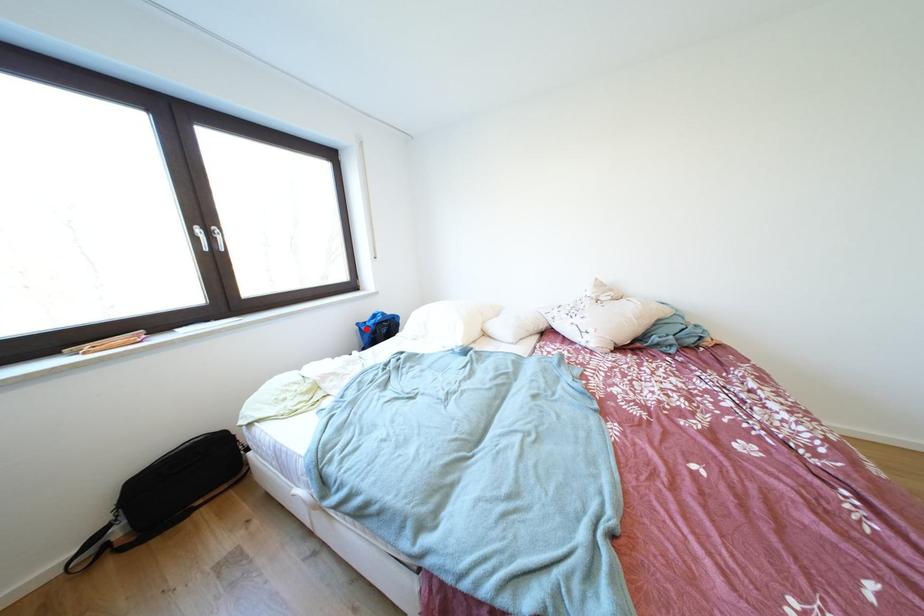
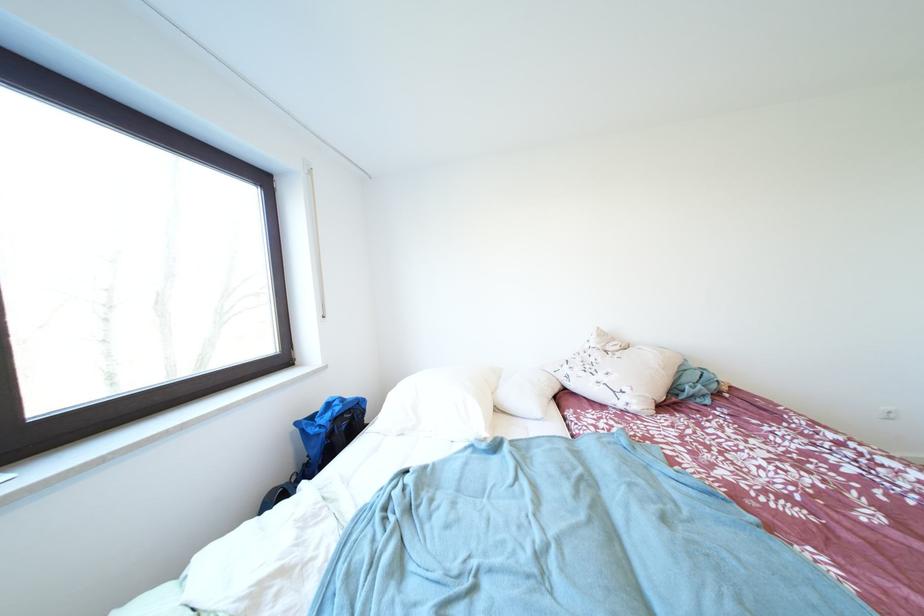
In the second image, find the point that corresponds to the highlighted location in the first image.

(305, 428)